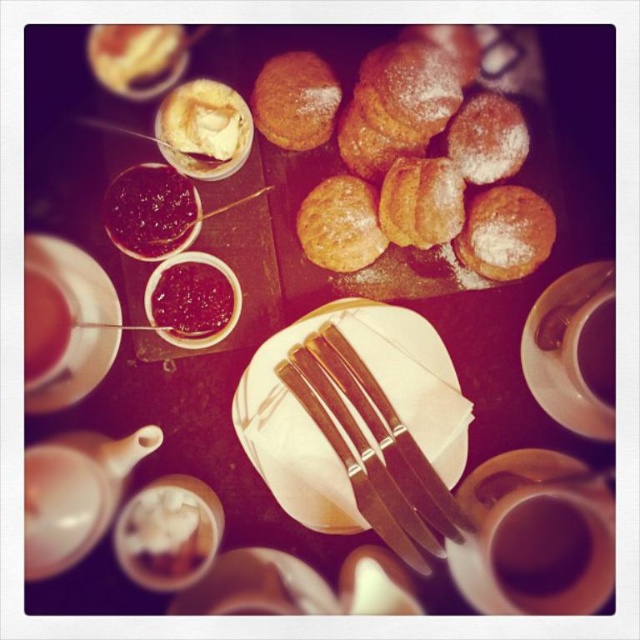
Question: Does powdery golden pastries at center appear under brown ceramic cup at right?

Choices:
 (A) yes
 (B) no

Answer: (B)

Question: Which point appears farthest from the camera in this image?

Choices:
 (A) (99, 276)
 (B) (51, 348)

Answer: (A)

Question: Which object is the closest to the white ceramic saucer at upper right?

Choices:
 (A) brown ceramic cup at right
 (B) powdered golden croissant at upper center
 (C) matte white teapot at bottom left

Answer: (A)

Question: Can you confirm if white paper plate at center is positioned to the right of powdered golden croissant at upper center?

Choices:
 (A) yes
 (B) no

Answer: (A)

Question: Can you confirm if powdery golden pastries at center is bigger than powdered golden croissant at upper center?

Choices:
 (A) yes
 (B) no

Answer: (A)

Question: Which of the following is the closest to the observer?

Choices:
 (A) (589, 429)
 (B) (518, 228)

Answer: (B)